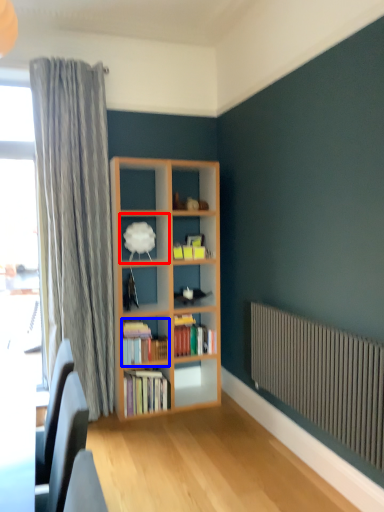
Question: Which object appears farthest to the camera in this image, shelf (highlighted by a red box) or book (highlighted by a blue box)?

Choices:
 (A) shelf
 (B) book

Answer: (B)